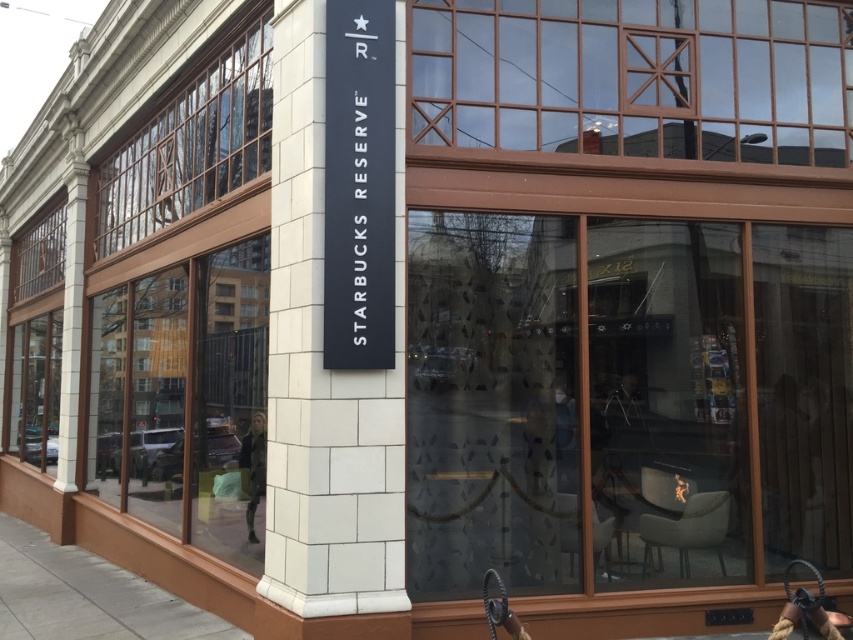
Question: Does gray concrete pavement at lower left appear under green fabric jacket at center?

Choices:
 (A) yes
 (B) no

Answer: (A)

Question: Which point is closer to the camera?

Choices:
 (A) (244, 438)
 (B) (10, 563)

Answer: (A)

Question: Is gray concrete pavement at lower left smaller than green fabric jacket at center?

Choices:
 (A) no
 (B) yes

Answer: (B)

Question: Which of the following is the closest to the observer?

Choices:
 (A) gray concrete pavement at lower left
 (B) green fabric jacket at center

Answer: (A)

Question: Can you confirm if gray concrete pavement at lower left is positioned above green fabric jacket at center?

Choices:
 (A) yes
 (B) no

Answer: (B)

Question: Which object is farther from the camera taking this photo?

Choices:
 (A) gray concrete pavement at lower left
 (B) green fabric jacket at center

Answer: (B)